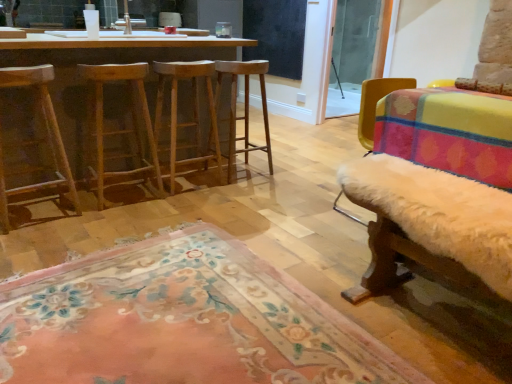
Question: Is wooden barstools at left facing towards natural wood stool at center, acting as the first stool starting from the left?

Choices:
 (A) no
 (B) yes

Answer: (B)

Question: Is wooden barstools at left turned away from natural wood stool at center, acting as the first stool starting from the left?

Choices:
 (A) no
 (B) yes

Answer: (B)

Question: Is wooden barstools at left thinner than natural wood stool at center, acting as the first stool starting from the left?

Choices:
 (A) no
 (B) yes

Answer: (A)

Question: Does wooden barstools at left have a smaller size compared to natural wood stool at center, placed as the 3th stool when sorted from right to left?

Choices:
 (A) yes
 (B) no

Answer: (B)

Question: Does wooden barstools at left lie behind natural wood stool at center, placed as the 3th stool when sorted from right to left?

Choices:
 (A) no
 (B) yes

Answer: (A)

Question: Is the surface of wooden barstools at left in direct contact with natural wood stool at center, placed as the 3th stool when sorted from right to left?

Choices:
 (A) yes
 (B) no

Answer: (B)

Question: Is black matte window screen at upper center smaller than wooden stool at center, marked as the first stool in a right-to-left arrangement?

Choices:
 (A) yes
 (B) no

Answer: (A)

Question: Can you confirm if black matte window screen at upper center is thinner than wooden stool at center, placed as the 3th stool when sorted from left to right?

Choices:
 (A) yes
 (B) no

Answer: (A)

Question: Does black matte window screen at upper center have a greater height compared to wooden stool at center, placed as the 3th stool when sorted from left to right?

Choices:
 (A) yes
 (B) no

Answer: (A)

Question: Is black matte window screen at upper center not within wooden stool at center, marked as the first stool in a right-to-left arrangement?

Choices:
 (A) yes
 (B) no

Answer: (A)

Question: From a real-world perspective, is black matte window screen at upper center on wooden stool at center, placed as the 3th stool when sorted from left to right?

Choices:
 (A) yes
 (B) no

Answer: (A)

Question: Considering the relative positions of black matte window screen at upper center and wooden stool at center, placed as the 3th stool when sorted from left to right, in the image provided, is black matte window screen at upper center to the right of wooden stool at center, placed as the 3th stool when sorted from left to right, from the viewer's perspective?

Choices:
 (A) yes
 (B) no

Answer: (A)

Question: Does black matte window screen at upper center lie in front of wooden stool at left?

Choices:
 (A) no
 (B) yes

Answer: (A)